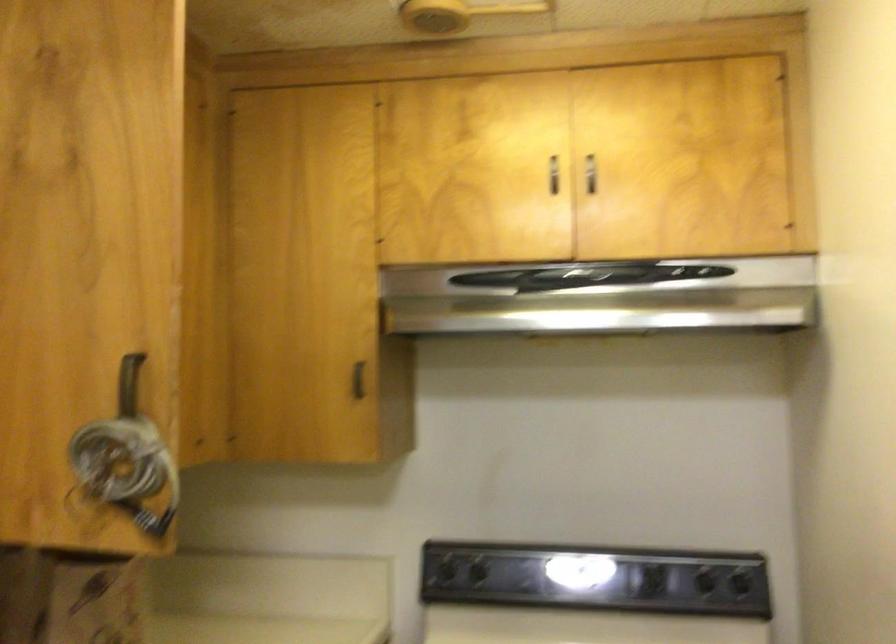
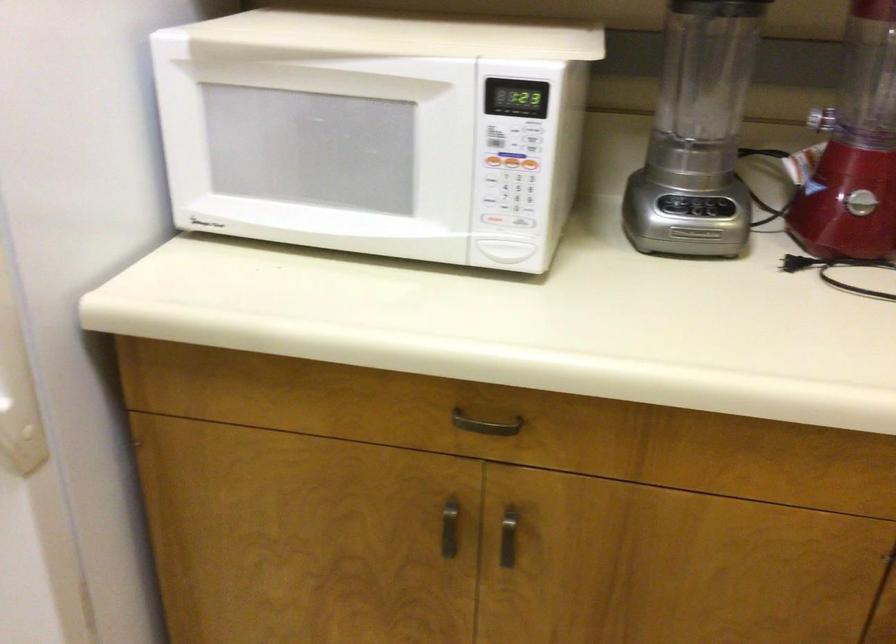
From the picture: The first image is from the beginning of the video and the second image is from the end. How did the camera likely rotate when shooting the video?

The camera rotated toward left-down.